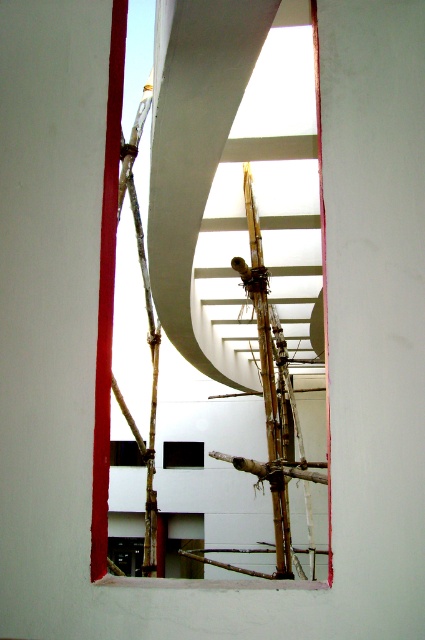
Is transparent plastic hole at center further to the viewer compared to transparent glass hole at lower center?

Yes, transparent plastic hole at center is further from the viewer.

Based on the photo, does transparent plastic hole at center have a lesser width compared to transparent glass hole at lower center?

Yes.

Does point (187, 464) come in front of point (127, 458)?

Yes, point (187, 464) is in front of point (127, 458).

Locate an element on the screen. Image resolution: width=425 pixels, height=640 pixels. transparent plastic hole at center is located at coordinates (183, 454).